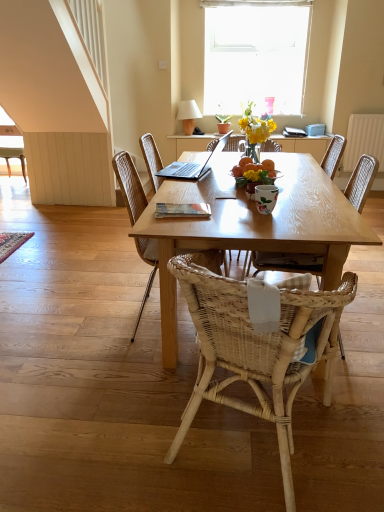
Find the location of a particular element. This screenshot has height=512, width=384. free space to the right of wooden book at center is located at coordinates (233, 210).